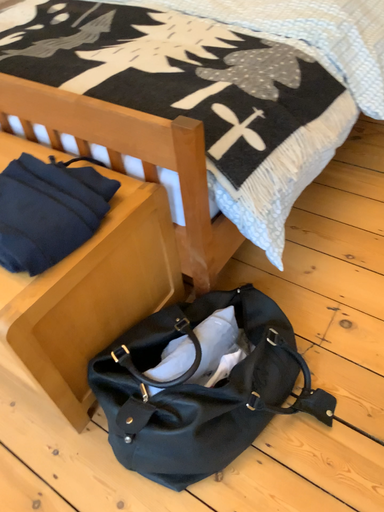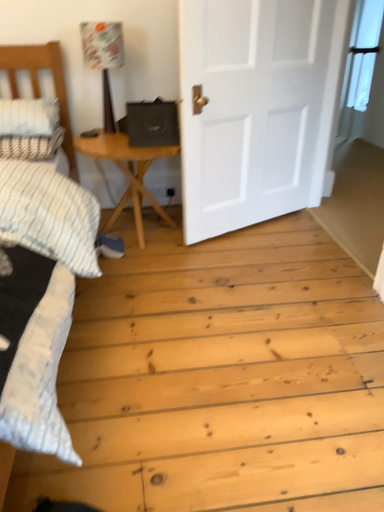
Question: Which way did the camera rotate in the video?

Choices:
 (A) rotated left
 (B) rotated right

Answer: (B)